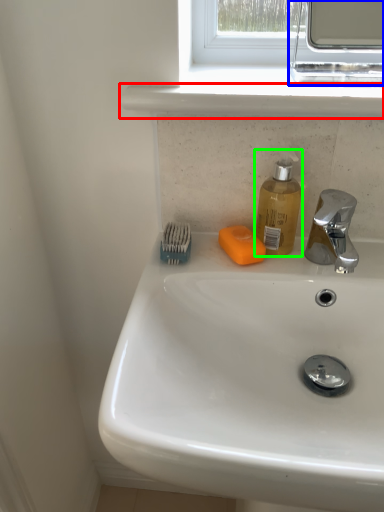
Question: Based on their relative distances, which object is farther from window sill (highlighted by a red box)? Choose from medicine cabinet (highlighted by a blue box) and soap dispenser (highlighted by a green box).

Choices:
 (A) medicine cabinet
 (B) soap dispenser

Answer: (A)